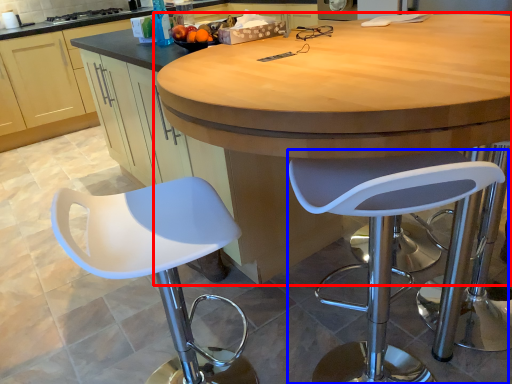
Question: Which object is further to the camera taking this photo, table (highlighted by a red box) or chair (highlighted by a blue box)?

Choices:
 (A) table
 (B) chair

Answer: (B)